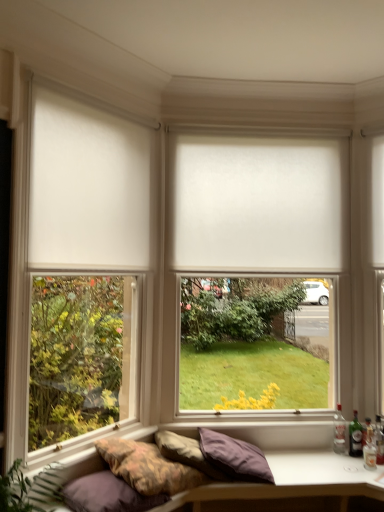
Find the location of a particular element. The width and height of the screenshot is (384, 512). free location in front of translucent glass bottle at right, the first bottle viewed from the right is located at coordinates (375, 474).